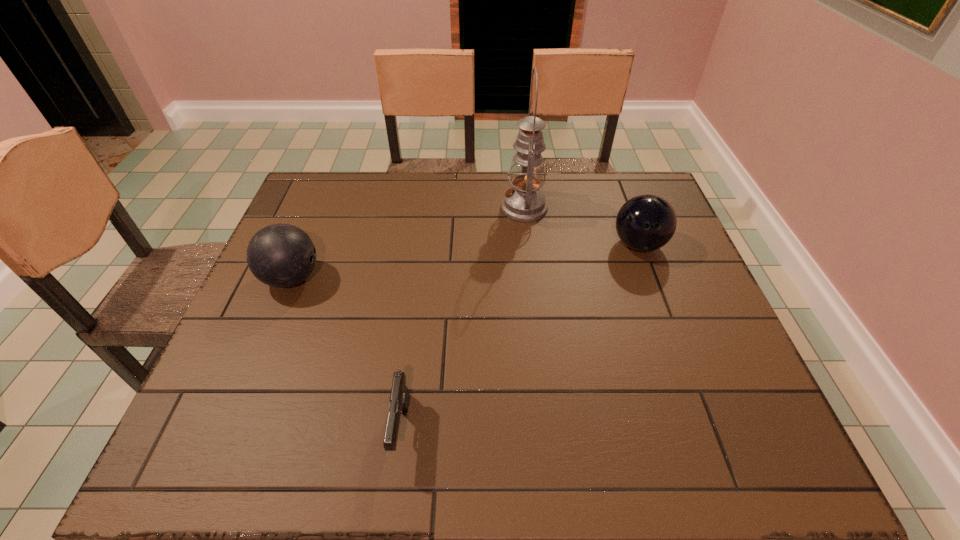
Locate an element on the screen. object located in the near edge section of the desktop is located at coordinates (399, 397).

Identify the location of object that is at the left edge. The image size is (960, 540). (280, 255).

The width and height of the screenshot is (960, 540). I want to click on object located at the right edge, so click(x=647, y=222).

The width and height of the screenshot is (960, 540). I want to click on free space at the far edge of the desktop, so click(467, 183).

Image resolution: width=960 pixels, height=540 pixels. In order to click on free space at the near edge of the desktop in this screenshot , I will do `click(292, 444)`.

Image resolution: width=960 pixels, height=540 pixels. In order to click on vacant region at the left edge of the desktop in this screenshot , I will do `click(254, 340)`.

Identify the location of free space at the right edge of the desktop. (698, 333).

The width and height of the screenshot is (960, 540). I want to click on vacant space at the far left corner of the desktop, so click(x=345, y=185).

Locate an element on the screen. This screenshot has height=540, width=960. vacant space at the far right corner is located at coordinates (634, 187).

Where is `vacant space at the near right corner of the desktop`? vacant space at the near right corner of the desktop is located at coordinates (771, 431).